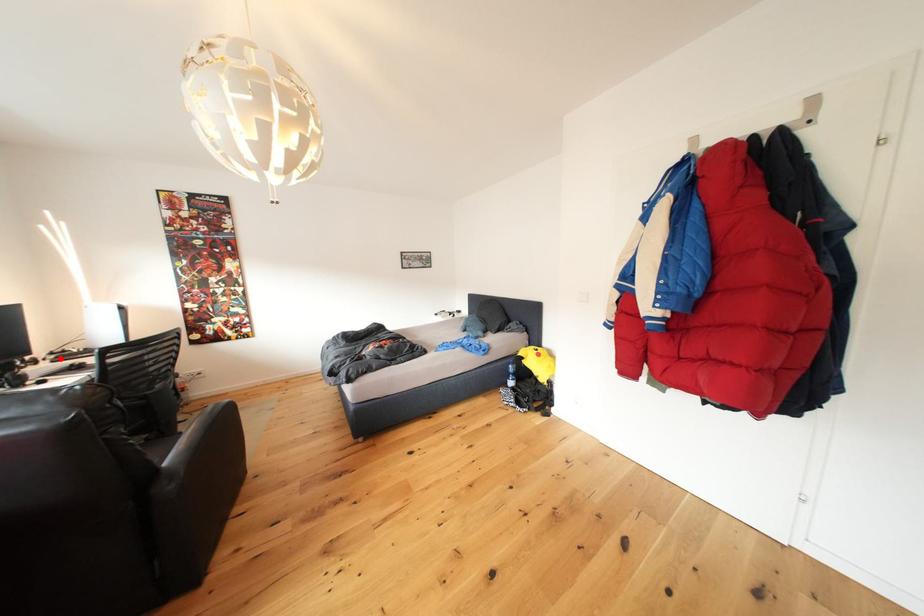
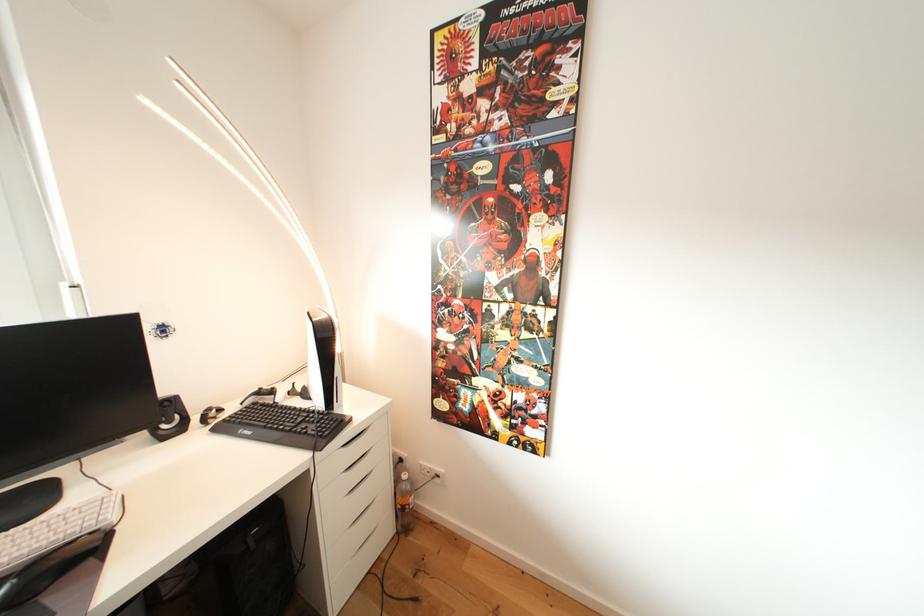
Question: I am providing you with two images of the same scene from different viewpoints. In image1, a red point is highlighted. Considering the same 3D point in image2, which of the following is correct?

Choices:
 (A) It is closer
 (B) It is farther

Answer: (A)